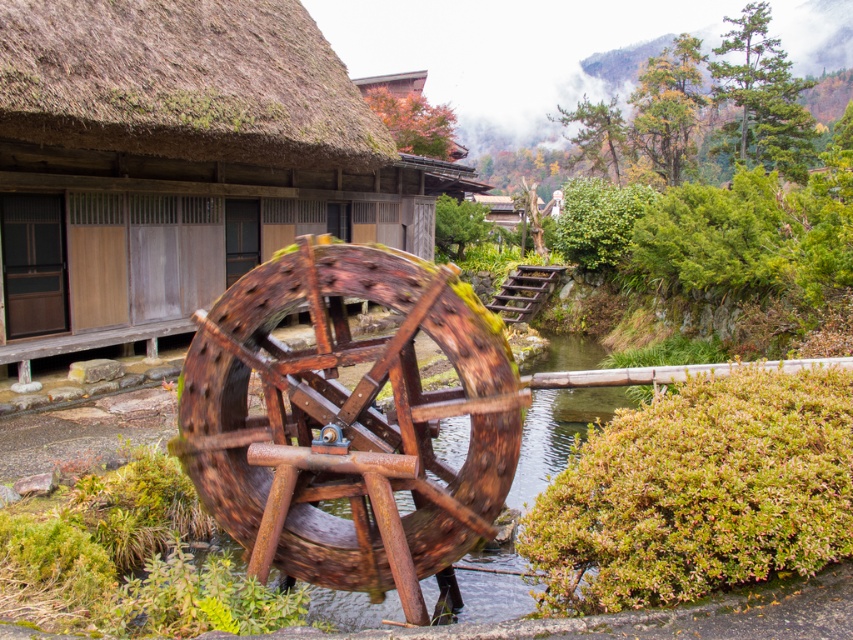
You are an engineer inspecting the scene. You need to determine which object between the rusty wood water wheel at center and the rusty wood wagon wheel at center is narrower. Which one is it?

The rusty wood water wheel at center has a lesser width compared to the rusty wood wagon wheel at center, so the rusty wood water wheel at center is narrower.

In the scene shown: You are standing at the entrance of the traditional Japanese house to the left of the rusty wood water wheel at center. You want to walk directly towards the water wheel. Which direction should you head?

Since the rusty wood water wheel at center is positioned at point (167, 161), you should head towards the center of the image to reach it directly.